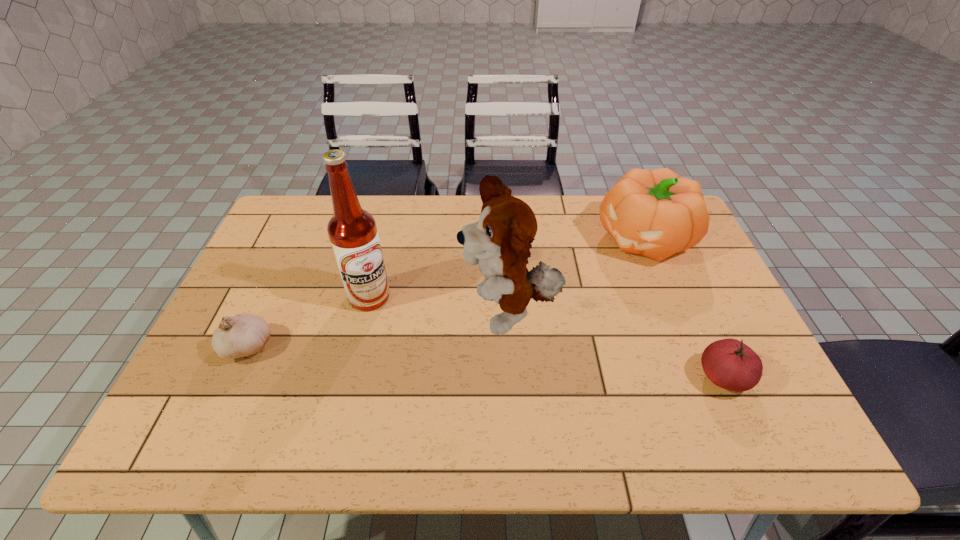
The height and width of the screenshot is (540, 960). I want to click on object positioned at the left edge, so click(244, 334).

This screenshot has width=960, height=540. In order to click on tomato that is at the right edge in this screenshot , I will do `click(729, 363)`.

Locate an element on the screen. pumpkin that is positioned at the right edge is located at coordinates (656, 213).

In order to click on object that is positioned at the far right corner in this screenshot , I will do `click(656, 213)`.

I want to click on object positioned at the near right corner, so tap(729, 363).

In the image, there is a desktop. Identify the location of vacant space at the far edge. (388, 221).

Locate an element on the screen. This screenshot has height=540, width=960. vacant space at the near edge of the desktop is located at coordinates (306, 384).

Find the location of a particular element. The height and width of the screenshot is (540, 960). blank space at the left edge is located at coordinates (237, 367).

The height and width of the screenshot is (540, 960). In the image, there is a desktop. Identify the location of free space at the right edge. (723, 302).

Locate an element on the screen. This screenshot has height=540, width=960. vacant area at the far left corner of the desktop is located at coordinates (299, 213).